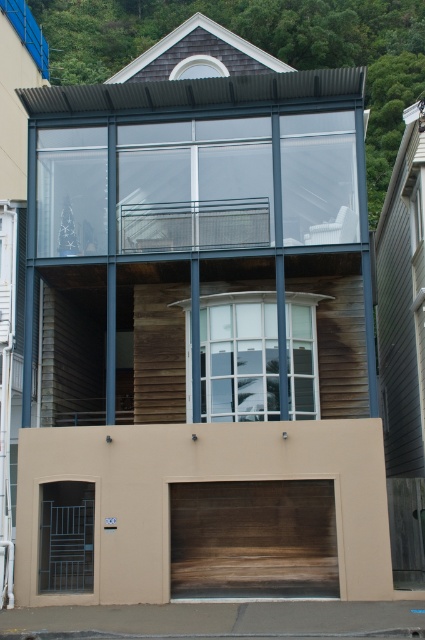
You are a delivery person standing at the entrance of the building. You need to deliver a package to the brown wood garage door at lower center. However, there is a wooden garage door at lower center nearby. How far apart are these two garage doors?

The brown wood garage door at lower center is 3.92 feet away from the wooden garage door at lower center.

You are a delivery person trying to park your van in front of the building. The van requires a parking space that is at least 6 meters long. Looking at the brown wood garage door at lower center and the wooden garage door at lower center, which one is more likely to have enough space for your van?

The wooden garage door at lower center is larger than the brown wood garage door at lower center, so it is more likely to have sufficient space for the van requiring at least 6 meters.

Based on the photo, you are standing in front of the building and want to enter through one of the garage doors. Which garage door should you approach first if you want to enter the building? Please choose between the brown wood garage door at lower center and the wooden garage door at lower center.

You should approach the brown wood garage door at lower center first because it is closer to you than the wooden garage door at lower center, which is further away.